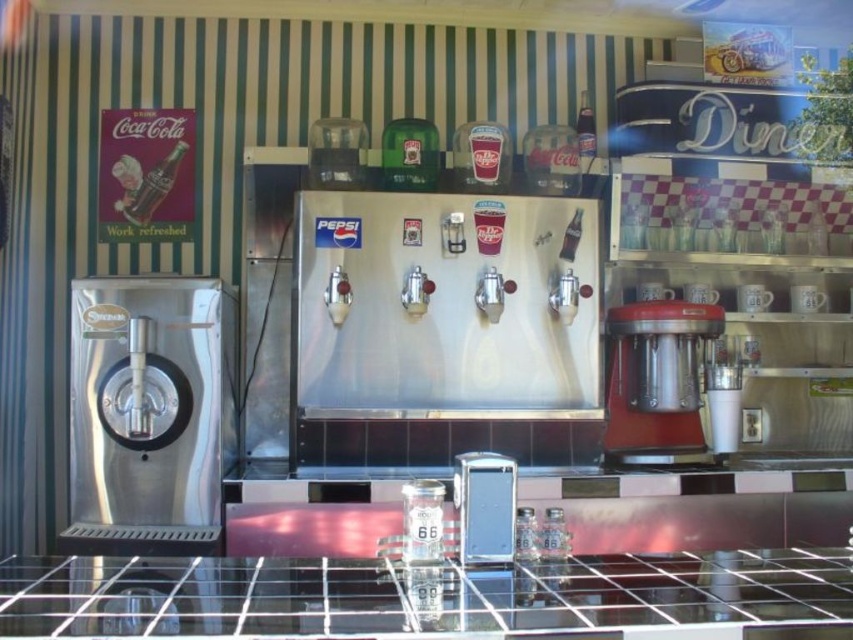
Question: Is brushed metal espresso machine at left smaller than metallic silver dispenser at center?

Choices:
 (A) yes
 (B) no

Answer: (B)

Question: Can you confirm if brushed metal espresso machine at left is bigger than metallic red coffee machine at center-right?

Choices:
 (A) yes
 (B) no

Answer: (A)

Question: Which point is closer to the camera?

Choices:
 (A) brushed metal espresso machine at left
 (B) metallic silver dispenser at center

Answer: (B)

Question: Among these objects, which one is nearest to the camera?

Choices:
 (A) brushed metal espresso machine at left
 (B) metallic red coffee machine at center-right
 (C) metallic silver dispenser at center

Answer: (C)

Question: Does brushed metal espresso machine at left have a larger size compared to metallic red coffee machine at center-right?

Choices:
 (A) yes
 (B) no

Answer: (A)

Question: Which object appears closest to the camera in this image?

Choices:
 (A) brushed metal espresso machine at left
 (B) metallic silver dispenser at center

Answer: (B)